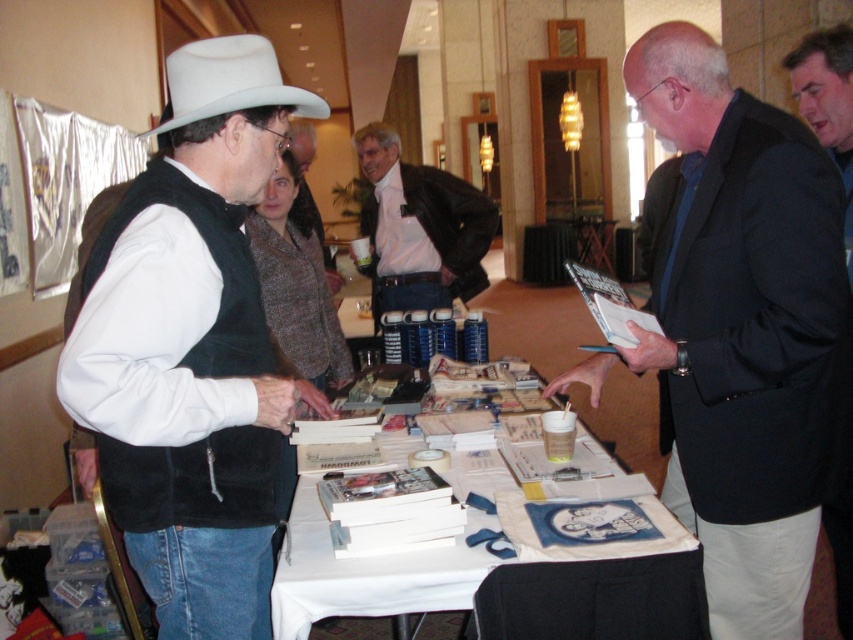
Question: Which object is the farthest from the black suit at center?

Choices:
 (A) white felt cowboy hat at upper left
 (B) pink shirt at center
 (C) matte brown vest at center

Answer: (C)

Question: In this image, where is dark blue suit jacket at center located relative to black suit at center?

Choices:
 (A) left
 (B) right

Answer: (A)

Question: Does pink shirt at center have a lesser width compared to white felt cowboy hat at upper left?

Choices:
 (A) no
 (B) yes

Answer: (A)

Question: Which of these objects is positioned closest to the pink shirt at center?

Choices:
 (A) dark blue suit jacket at center
 (B) white matte cowboy hat at upper left
 (C) white felt cowboy hat at upper left

Answer: (A)

Question: Among these objects, which one is farthest from the camera?

Choices:
 (A) dark blue suit jacket at center
 (B) black suit at center
 (C) white paper table at center

Answer: (B)

Question: Is white matte cowboy hat at upper left above black suit at center?

Choices:
 (A) yes
 (B) no

Answer: (B)